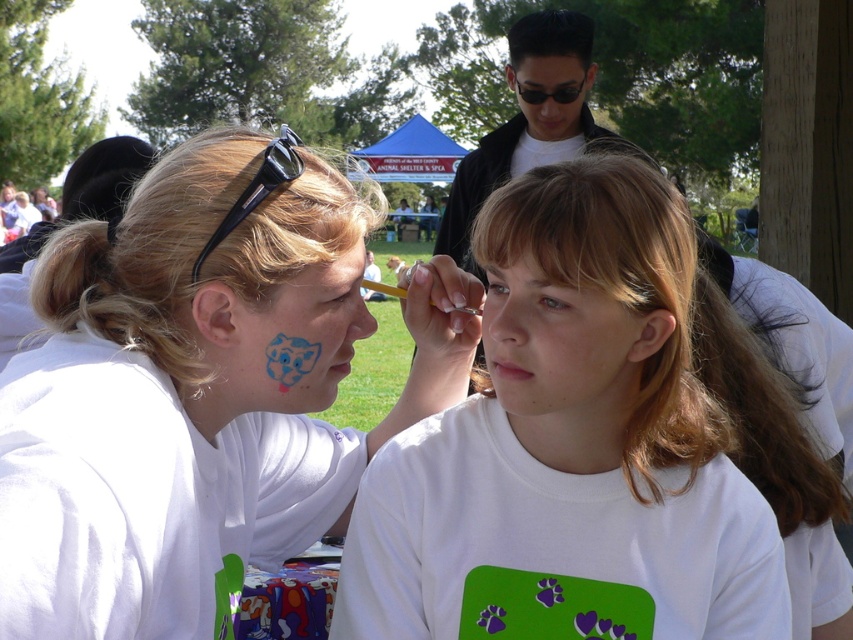
Question: Which of the following is the closest to the observer?

Choices:
 (A) (119, 278)
 (B) (490, 364)

Answer: (A)

Question: Does white matte shirt at center have a larger size compared to matte black face at upper center?

Choices:
 (A) no
 (B) yes

Answer: (A)

Question: Can you confirm if black plastic sunglasses at upper left is positioned to the left of matte black forehead at upper center?

Choices:
 (A) yes
 (B) no

Answer: (A)

Question: Which point is closer to the camera?

Choices:
 (A) (509, 358)
 (B) (527, 99)
 (C) (299, 499)

Answer: (A)

Question: Which point is closer to the camera taking this photo?

Choices:
 (A) (541, 64)
 (B) (293, 163)
 (C) (225, 228)

Answer: (C)

Question: Observing the image, what is the correct spatial positioning of matte black face at upper center in reference to black plastic sunglasses at upper left?

Choices:
 (A) right
 (B) left

Answer: (A)